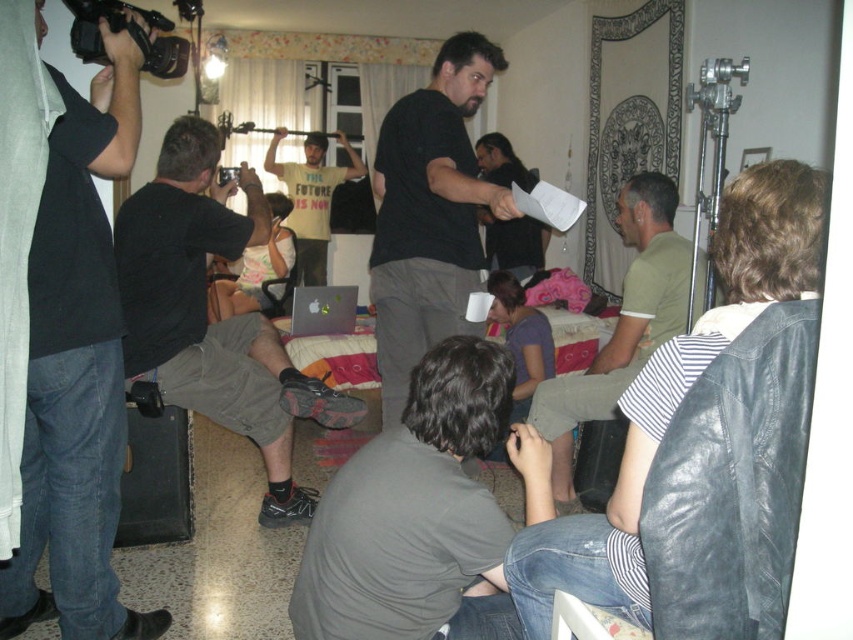
Image resolution: width=853 pixels, height=640 pixels. What are the coordinates of `dark gray jeans at left` in the screenshot? It's located at (77, 371).

Where is `dark gray jeans at left`? The width and height of the screenshot is (853, 640). dark gray jeans at left is located at coordinates (77, 371).

Image resolution: width=853 pixels, height=640 pixels. I want to click on black cotton t-shirt at center, so click(x=207, y=314).

Does black cotton t-shirt at center appear on the right side of black plastic video camera at upper left?

Indeed, black cotton t-shirt at center is positioned on the right side of black plastic video camera at upper left.

Which is in front, point (216, 156) or point (74, 52)?

Point (74, 52) is in front.

This screenshot has width=853, height=640. What are the coordinates of `black cotton t-shirt at center` in the screenshot? It's located at click(207, 314).

Does green cotton shirt at center appear on the left side of black plastic video camera at upper center?

No, green cotton shirt at center is not to the left of black plastic video camera at upper center.

Between point (543, 401) and point (221, 180), which one is positioned in front?

Positioned in front is point (543, 401).

The height and width of the screenshot is (640, 853). In order to click on green cotton shirt at center in this screenshot , I will do `click(624, 323)`.

Image resolution: width=853 pixels, height=640 pixels. I want to click on green cotton shirt at center, so click(x=624, y=323).